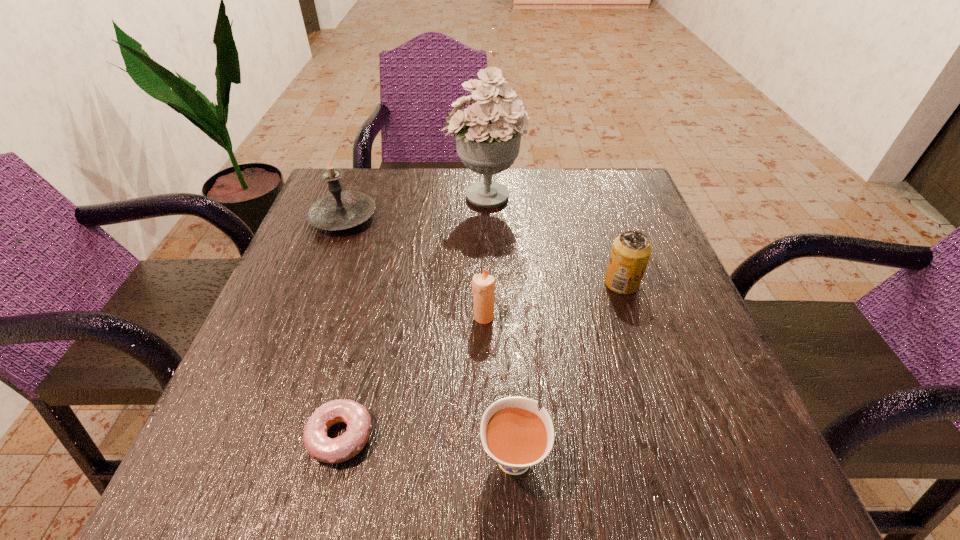
The image size is (960, 540). I want to click on doughnut at the near edge, so pyautogui.click(x=320, y=447).

The height and width of the screenshot is (540, 960). Identify the location of candle that is at the left edge. (338, 210).

Identify the location of doughnut that is at the left edge. The height and width of the screenshot is (540, 960). (320, 447).

You are a GUI agent. You are given a task and a screenshot of the screen. Output one action in this format:
    pyautogui.click(x=<x>, y=<y>)
    Task: Click on the object that is at the right edge
    The width and height of the screenshot is (960, 540).
    Given the screenshot: What is the action you would take?
    pyautogui.click(x=631, y=251)

This screenshot has width=960, height=540. What are the coordinates of `object present at the far left corner` in the screenshot? It's located at (338, 210).

Find the location of a particular element. The height and width of the screenshot is (540, 960). object located in the near left corner section of the desktop is located at coordinates click(x=320, y=447).

I want to click on vacant region at the far edge, so click(422, 187).

At what (x,y) coordinates should I click in order to perform the action: click on vacant space at the near edge. Please return your answer as a coordinate pair (x, y). The image size is (960, 540). Looking at the image, I should click on (535, 497).

Locate an element on the screen. Image resolution: width=960 pixels, height=540 pixels. free space at the left edge of the desktop is located at coordinates click(342, 264).

The image size is (960, 540). Identify the location of vacant space at the far left corner of the desktop. (371, 177).